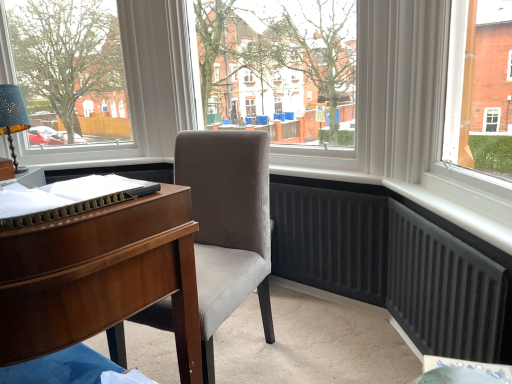
This screenshot has height=384, width=512. Describe the element at coordinates (13, 118) in the screenshot. I see `matte blue lampshade at left` at that location.

Describe the element at coordinates (227, 225) in the screenshot. The height and width of the screenshot is (384, 512). I see `velvet grey chair at center` at that location.

Locate an element on the screen. velvet grey chair at center is located at coordinates (227, 225).

In order to face transparent glass window at center, should I rotate leftwards or rightwards?

It's best to rotate right around 1.781 degrees.

The image size is (512, 384). Identify the location of matte blue lampshade at left. (13, 118).

From the image's perspective, which one is positioned higher, velvet grey chair at center or matte blue lampshade at left?

matte blue lampshade at left, from the image's perspective.

Considering the sizes of objects velvet grey chair at center and matte blue lampshade at left in the image provided, who is thinner, velvet grey chair at center or matte blue lampshade at left?

matte blue lampshade at left is thinner.

Is velvet grey chair at center at the right side of matte blue lampshade at left?

Indeed, velvet grey chair at center is positioned on the right side of matte blue lampshade at left.

Is velvet grey chair at center shorter than matte blue lampshade at left?

Incorrect, the height of velvet grey chair at center does not fall short of that of matte blue lampshade at left.

In the scene shown: Is transparent glass window at center further to the viewer compared to velvet grey chair at center?

Yes, it is.

Between transparent glass window at center and velvet grey chair at center, which one has larger width?

With larger width is velvet grey chair at center.

Looking at this image, could you tell me if transparent glass window at center is turned towards velvet grey chair at center?

Yes.

Which is in front, point (329, 45) or point (203, 289)?

Point (203, 289)

In the scene shown: From a real-world perspective, which is physically below, matte white frame at upper left or matte blue lampshade at left?

matte blue lampshade at left is physically lower.

Is matte white frame at upper left located outside matte blue lampshade at left?

Yes, matte white frame at upper left is outside of matte blue lampshade at left.

Is matte white frame at upper left shorter than matte blue lampshade at left?

No.

Which object is wider, matte white frame at upper left or matte blue lampshade at left?

Wider between the two is matte white frame at upper left.

Considering the relative sizes of matte blue lampshade at left and velvet grey chair at center in the image provided, is matte blue lampshade at left smaller than velvet grey chair at center?

Indeed, matte blue lampshade at left has a smaller size compared to velvet grey chair at center.

Measure the distance between matte blue lampshade at left and velvet grey chair at center.

matte blue lampshade at left and velvet grey chair at center are 5.29 feet apart.

In the scene shown: Is matte blue lampshade at left far from velvet grey chair at center?

matte blue lampshade at left is positioned a significant distance from velvet grey chair at center.

Where is `lamp above the velvet grey chair at center (from the image's perspective)`? The image size is (512, 384). lamp above the velvet grey chair at center (from the image's perspective) is located at coordinates (13, 118).

Is matte blue lampshade at left closer to camera compared to matte white frame at upper left?

Yes.

In the scene shown: From the image's perspective, is matte blue lampshade at left positioned above or below matte white frame at upper left?

Clearly, from the image's perspective, matte blue lampshade at left is below matte white frame at upper left.

Is matte blue lampshade at left oriented towards matte white frame at upper left?

No, matte blue lampshade at left is not facing towards matte white frame at upper left.

I want to click on lamp that is under the matte white frame at upper left (from a real-world perspective), so click(x=13, y=118).

How many degrees apart are the facing directions of transparent glass window at center and matte white frame at upper left?

41.7 degrees.

In the image, is transparent glass window at center positioned in front of or behind matte white frame at upper left?

Visually, transparent glass window at center is located in front of matte white frame at upper left.

From a real-world perspective, is transparent glass window at center below matte white frame at upper left?

Yes, from a real-world perspective, transparent glass window at center is below matte white frame at upper left.

Based on the photo, would you consider transparent glass window at center to be distant from matte white frame at upper left?

No, there isn't a large distance between transparent glass window at center and matte white frame at upper left.

Consider the image. Which is nearer, (250, 270) or (54, 111)?

Positioned in front is point (250, 270).

From the picture: From the image's perspective, would you say velvet grey chair at center is shown under matte white frame at upper left?

Yes, from the image's perspective, velvet grey chair at center is beneath matte white frame at upper left.

Who is taller, velvet grey chair at center or matte white frame at upper left?

matte white frame at upper left.

Considering the relative positions of velvet grey chair at center and matte white frame at upper left in the image provided, is velvet grey chair at center to the right of matte white frame at upper left from the viewer's perspective?

Yes.

This screenshot has height=384, width=512. Identify the location of lamp that appears behind the velvet grey chair at center. (13, 118).

This screenshot has width=512, height=384. Find the location of `chair on the left side of transparent glass window at center`. chair on the left side of transparent glass window at center is located at coordinates (227, 225).

Based on their spatial positions, is velvet grey chair at center or transparent glass window at center further from matte blue lampshade at left?

The object further to matte blue lampshade at left is velvet grey chair at center.

Based on their spatial positions, is matte white frame at upper left or transparent glass window at center further from velvet grey chair at center?

matte white frame at upper left is further to velvet grey chair at center.

Estimate the real-world distances between objects in this image. Which object is closer to velvet grey chair at center, transparent glass window at center or matte white frame at upper left?

transparent glass window at center.

Estimate the real-world distances between objects in this image. Which object is further from transparent glass window at center, velvet grey chair at center or matte blue lampshade at left?

matte blue lampshade at left is further to transparent glass window at center.

Looking at the image, which one is located closer to transparent glass window at center, matte blue lampshade at left or velvet grey chair at center?

The object closer to transparent glass window at center is velvet grey chair at center.

Estimate the real-world distances between objects in this image. Which object is further from matte blue lampshade at left, matte white frame at upper left or velvet grey chair at center?

Among the two, velvet grey chair at center is located further to matte blue lampshade at left.

Considering their positions, is transparent glass window at center positioned closer to matte blue lampshade at left than matte white frame at upper left?

Based on the image, matte white frame at upper left appears to be nearer to matte blue lampshade at left.

In the scene shown: Which object lies further to the anchor point matte blue lampshade at left, transparent glass window at center or velvet grey chair at center?

velvet grey chair at center.

The width and height of the screenshot is (512, 384). In order to click on chair between matte blue lampshade at left and transparent glass window at center from left to right in this screenshot , I will do point(227,225).

The width and height of the screenshot is (512, 384). In order to click on window between matte blue lampshade at left and transparent glass window at center in this screenshot , I will do `click(70, 72)`.

This screenshot has height=384, width=512. What are the coordinates of `lamp between velvet grey chair at center and matte white frame at upper left from front to back` in the screenshot? It's located at (13, 118).

Where is `chair situated between matte white frame at upper left and transparent glass window at center from left to right`? chair situated between matte white frame at upper left and transparent glass window at center from left to right is located at coordinates (227, 225).